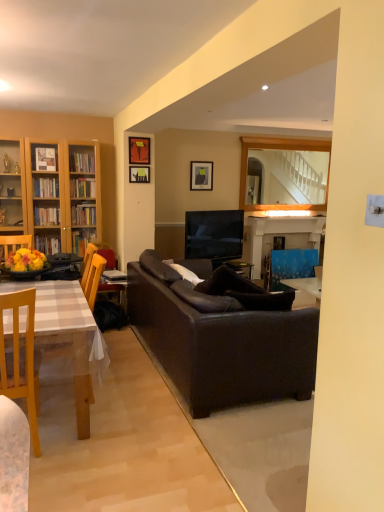
Question: From the image's perspective, would you say matte black picture frame at upper center, the 2th picture frame viewed from the left, is shown under blue painted wood fireplace at center?

Choices:
 (A) yes
 (B) no

Answer: (B)

Question: Is matte black picture frame at upper center, positioned as the first picture frame in front-to-back order, in contact with blue painted wood fireplace at center?

Choices:
 (A) no
 (B) yes

Answer: (A)

Question: Is matte black picture frame at upper center, positioned as the first picture frame in front-to-back order, to the right of blue painted wood fireplace at center from the viewer's perspective?

Choices:
 (A) no
 (B) yes

Answer: (A)

Question: Is matte black picture frame at upper center, the second picture frame when ordered from right to left, taller than blue painted wood fireplace at center?

Choices:
 (A) yes
 (B) no

Answer: (B)

Question: Is matte black picture frame at upper center, positioned as the first picture frame in front-to-back order, positioned with its back to blue painted wood fireplace at center?

Choices:
 (A) yes
 (B) no

Answer: (B)

Question: In terms of width, does hardcover book at center look wider or thinner when compared to matte black picture frame at upper center, the 2th picture frame viewed from the left?

Choices:
 (A) wide
 (B) thin

Answer: (A)

Question: Is hardcover book at center taller or shorter than matte black picture frame at upper center, the 2th picture frame viewed from the left?

Choices:
 (A) short
 (B) tall

Answer: (A)

Question: Looking at the image, does hardcover book at center seem bigger or smaller compared to matte black picture frame at upper center, positioned as the first picture frame in front-to-back order?

Choices:
 (A) big
 (B) small

Answer: (A)

Question: Does point (120, 272) appear closer or farther from the camera than point (144, 163)?

Choices:
 (A) closer
 (B) farther

Answer: (B)

Question: Visually, is blue glossy armchair at right, which is the 1th armchair from right to left, positioned to the left or to the right of matte black picture frame at upper center, the third picture frame positioned from the back?

Choices:
 (A) left
 (B) right

Answer: (B)

Question: From the image's perspective, is blue glossy armchair at right, placed as the first armchair when sorted from back to front, positioned above or below matte black picture frame at upper center, positioned as the first picture frame in front-to-back order?

Choices:
 (A) above
 (B) below

Answer: (B)

Question: From their relative heights in the image, would you say blue glossy armchair at right, placed as the first armchair when sorted from back to front, is taller or shorter than matte black picture frame at upper center, positioned as the first picture frame in front-to-back order?

Choices:
 (A) short
 (B) tall

Answer: (B)

Question: Considering the positions of point (278, 276) and point (148, 154), is point (278, 276) closer or farther from the camera than point (148, 154)?

Choices:
 (A) farther
 (B) closer

Answer: (B)

Question: Considering the positions of point (107, 273) and point (193, 185), is point (107, 273) closer or farther from the camera than point (193, 185)?

Choices:
 (A) farther
 (B) closer

Answer: (B)

Question: From the image's perspective, is hardcover book at center located above or below matte black picture frame at upper center, which is counted as the third picture frame, starting from the left?

Choices:
 (A) above
 (B) below

Answer: (B)